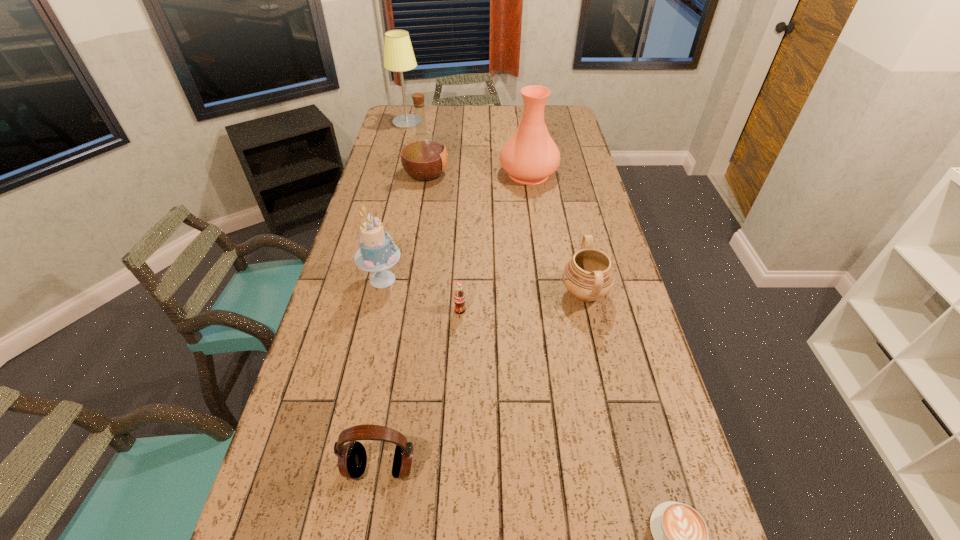
The image size is (960, 540). I want to click on free space that is in between the fourth tallest object and the vase, so click(x=456, y=226).

Identify the location of vacant space that is in between the headset and the vase. The height and width of the screenshot is (540, 960). (454, 320).

At what (x,y) coordinates should I click in order to perform the action: click on free point between the soda and the vase. Please return your answer as a coordinate pair (x, y). The width and height of the screenshot is (960, 540). Looking at the image, I should click on (494, 242).

Locate which object is the second closest to the urn. Please provide its 2D coordinates. Your answer should be formatted as a tuple, i.e. [(x, y)], where the tuple contains the x and y coordinates of a point satisfying the conditions above.

[(530, 156)]

Select which object is the seventh closest to the cake. Please provide its 2D coordinates. Your answer should be formatted as a tuple, i.e. [(x, y)], where the tuple contains the x and y coordinates of a point satisfying the conditions above.

[(398, 53)]

Locate an element on the screen. The image size is (960, 540). free spot that satisfies the following two spatial constraints: 1. on the front label of the vase; 2. on the right side of the liquor is located at coordinates (426, 173).

Image resolution: width=960 pixels, height=540 pixels. Find the location of `free region that satisfies the following two spatial constraints: 1. on the front label of the fourth object from right to left; 2. on the left side of the liquor`. free region that satisfies the following two spatial constraints: 1. on the front label of the fourth object from right to left; 2. on the left side of the liquor is located at coordinates (404, 310).

Where is `free space that satisfies the following two spatial constraints: 1. on the front label of the liquor; 2. on the left side of the vase`? Image resolution: width=960 pixels, height=540 pixels. free space that satisfies the following two spatial constraints: 1. on the front label of the liquor; 2. on the left side of the vase is located at coordinates pos(426,173).